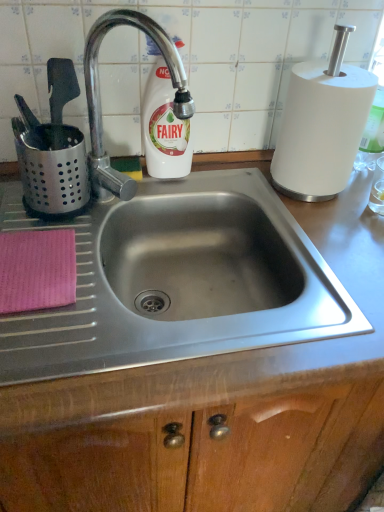
I want to click on vacant space in front of white glossy bottle at upper center, so click(x=130, y=199).